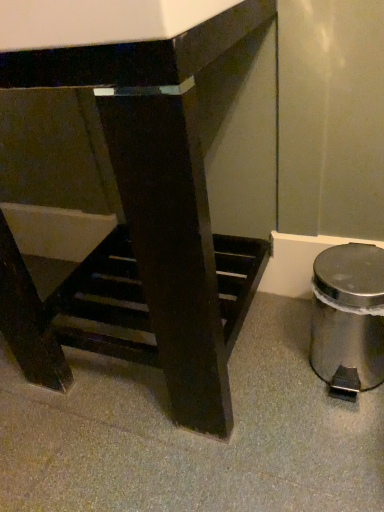
This screenshot has width=384, height=512. I want to click on polished stainless steel trash can at lower right, so click(348, 317).

Describe the element at coordinates (348, 317) in the screenshot. The height and width of the screenshot is (512, 384). I see `polished stainless steel trash can at lower right` at that location.

The height and width of the screenshot is (512, 384). In order to click on matte black table at center in this screenshot , I will do `click(144, 224)`.

What do you see at coordinates (144, 224) in the screenshot?
I see `matte black table at center` at bounding box center [144, 224].

Locate an element on the screen. The width and height of the screenshot is (384, 512). polished stainless steel trash can at lower right is located at coordinates (348, 317).

Can you confirm if matte black table at center is positioned to the left of polished stainless steel trash can at lower right?

Correct, you'll find matte black table at center to the left of polished stainless steel trash can at lower right.

Is matte black table at center further to the viewer compared to polished stainless steel trash can at lower right?

No, it is in front of polished stainless steel trash can at lower right.

Which is closer, (50,55) or (370,287)?

The point (50,55) is in front.

From the image's perspective, which is below, matte black table at center or polished stainless steel trash can at lower right?

From the image's view, polished stainless steel trash can at lower right is below.

From a real-world perspective, is matte black table at center above or below polished stainless steel trash can at lower right?

From a real-world perspective, matte black table at center is physically above polished stainless steel trash can at lower right.

In terms of width, does matte black table at center look wider or thinner when compared to polished stainless steel trash can at lower right?

Clearly, matte black table at center has more width compared to polished stainless steel trash can at lower right.

Between matte black table at center and polished stainless steel trash can at lower right, which one has more height?

matte black table at center is taller.

Based on their sizes in the image, would you say matte black table at center is bigger or smaller than polished stainless steel trash can at lower right?

Considering their sizes, matte black table at center takes up more space than polished stainless steel trash can at lower right.

Is matte black table at center surrounding polished stainless steel trash can at lower right?

No, polished stainless steel trash can at lower right is not a part of matte black table at center.

Is matte black table at center placed right next to polished stainless steel trash can at lower right?

No, matte black table at center is not in contact with polished stainless steel trash can at lower right.

Is matte black table at center turned away from polished stainless steel trash can at lower right?

No, matte black table at center is not facing away from polished stainless steel trash can at lower right.

The width and height of the screenshot is (384, 512). I want to click on table that is above the polished stainless steel trash can at lower right (from a real-world perspective), so (144, 224).

Which is more to the left, polished stainless steel trash can at lower right or matte black table at center?

matte black table at center.

Relative to matte black table at center, is polished stainless steel trash can at lower right in front or behind?

Clearly, polished stainless steel trash can at lower right is behind matte black table at center.

Considering the positions of points (319, 273) and (124, 255), is point (319, 273) farther from camera compared to point (124, 255)?

No, (319, 273) is in front of (124, 255).

From the image's perspective, is polished stainless steel trash can at lower right located beneath matte black table at center?

Correct, polished stainless steel trash can at lower right appears lower than matte black table at center in the image.

From a real-world perspective, which object rests below the other?

From a 3D spatial view, polished stainless steel trash can at lower right is below.

Considering the relative sizes of polished stainless steel trash can at lower right and matte black table at center in the image provided, is polished stainless steel trash can at lower right thinner than matte black table at center?

Yes, polished stainless steel trash can at lower right is thinner than matte black table at center.

Which of these two, polished stainless steel trash can at lower right or matte black table at center, stands taller?

Standing taller between the two is matte black table at center.

Is polished stainless steel trash can at lower right bigger or smaller than matte black table at center?

polished stainless steel trash can at lower right is smaller than matte black table at center.

Based on the photo, would you say polished stainless steel trash can at lower right is inside or outside matte black table at center?

polished stainless steel trash can at lower right is outside matte black table at center.

Are polished stainless steel trash can at lower right and matte black table at center located far from each other?

Actually, polished stainless steel trash can at lower right and matte black table at center are a little close together.

Is polished stainless steel trash can at lower right aimed at matte black table at center?

No, polished stainless steel trash can at lower right is not turned towards matte black table at center.

The image size is (384, 512). I want to click on waste container that appears below the matte black table at center (from the image's perspective), so click(x=348, y=317).

You are a GUI agent. You are given a task and a screenshot of the screen. Output one action in this format:
    pyautogui.click(x=<x>, y=<y>)
    Task: Click on the table that is above the polished stainless steel trash can at lower right (from the image's perspective)
    This screenshot has height=512, width=384.
    Given the screenshot: What is the action you would take?
    pyautogui.click(x=144, y=224)

The height and width of the screenshot is (512, 384). I want to click on waste container located behind the matte black table at center, so click(x=348, y=317).